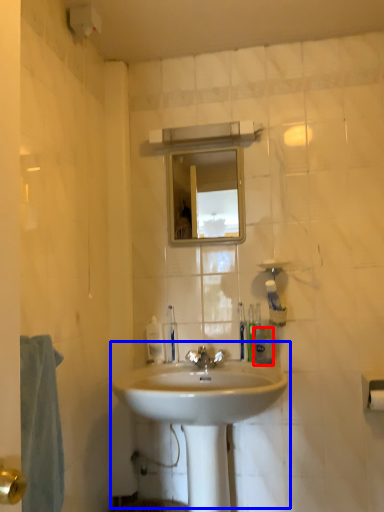
Question: Among these objects, which one is farthest to the camera, toiletry (highlighted by a red box) or sink (highlighted by a blue box)?

Choices:
 (A) toiletry
 (B) sink

Answer: (A)